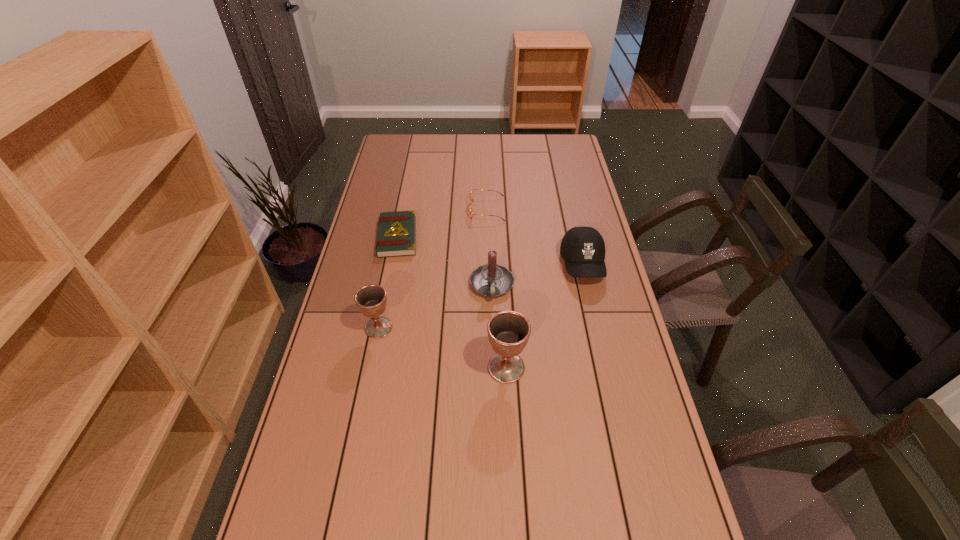
This screenshot has height=540, width=960. Identify the location of unoccupied area between the candle and the rightmost object. (538, 275).

Identify which object is located as the nearest to the shortest object. Please provide its 2D coordinates. Your answer should be formatted as a tuple, i.e. [(x, y)], where the tuple contains the x and y coordinates of a point satisfying the conditions above.

[(471, 193)]

This screenshot has width=960, height=540. Find the location of `object identified as the second closest to the candle`. object identified as the second closest to the candle is located at coordinates (508, 331).

This screenshot has width=960, height=540. In order to click on vacant position in the image that satisfies the following two spatial constraints: 1. on the back side of the book; 2. on the left side of the shorter chalice in this screenshot , I will do `click(396, 237)`.